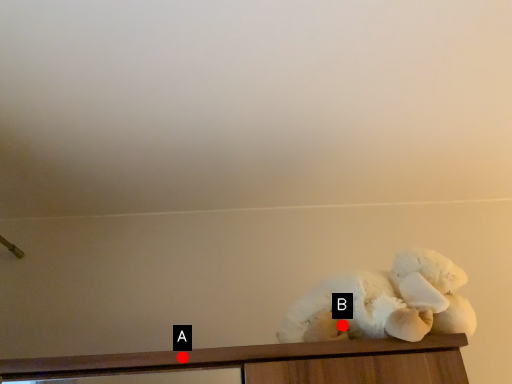
Question: Two points are circled on the image, labeled by A and B beside each circle. Which point appears farthest from the camera in this image?

Choices:
 (A) A is further
 (B) B is further

Answer: (B)